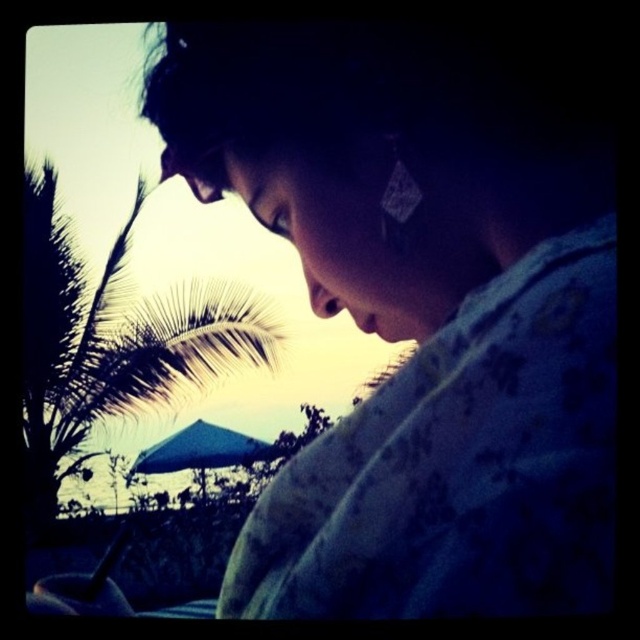
Is matte floral shirt at center bigger than silvery leafy palm tree at upper left?

Incorrect, matte floral shirt at center is not larger than silvery leafy palm tree at upper left.

Does matte floral shirt at center have a lesser height compared to silvery leafy palm tree at upper left?

Yes, matte floral shirt at center is shorter than silvery leafy palm tree at upper left.

Between point (611, 161) and point (93, 298), which one is positioned behind?

Point (93, 298)

You are a GUI agent. You are given a task and a screenshot of the screen. Output one action in this format:
    pyautogui.click(x=<x>, y=<y>)
    Task: Click on the matte floral shirt at center
    This screenshot has height=640, width=640.
    Given the screenshot: What is the action you would take?
    (x=419, y=312)